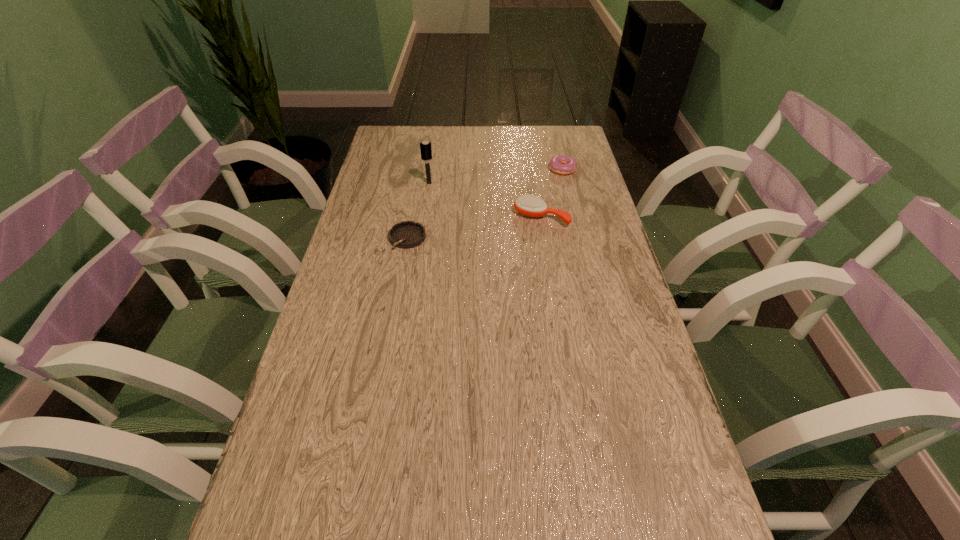
Locate an element on the screen. The image size is (960, 540). blank space located on the back of the ashtray is located at coordinates (415, 197).

Where is `object located in the far edge section of the desktop`? The image size is (960, 540). object located in the far edge section of the desktop is located at coordinates (562, 164).

This screenshot has height=540, width=960. What are the coordinates of `object that is at the left edge` in the screenshot? It's located at (407, 234).

You are a GUI agent. You are given a task and a screenshot of the screen. Output one action in this format:
    pyautogui.click(x=<x>, y=<y>)
    Task: Click on the hairbrush located in the right edge section of the desktop
    
    Given the screenshot: What is the action you would take?
    pyautogui.click(x=529, y=205)

At what (x,y) coordinates should I click in order to perform the action: click on doughnut located at the right edge. Please return your answer as a coordinate pair (x, y). The width and height of the screenshot is (960, 540). Looking at the image, I should click on (562, 164).

I want to click on object at the far right corner, so [562, 164].

At what (x,y) coordinates should I click in order to perform the action: click on free space at the far edge. Please return your answer as a coordinate pair (x, y). Looking at the image, I should click on (525, 146).

This screenshot has width=960, height=540. Find the location of `free spot at the left edge of the desktop`. free spot at the left edge of the desktop is located at coordinates 287,469.

In order to click on free region at the right edge of the desktop in this screenshot , I will do `click(586, 393)`.

Identify the location of free spot at the far left corner of the desktop. (407, 132).